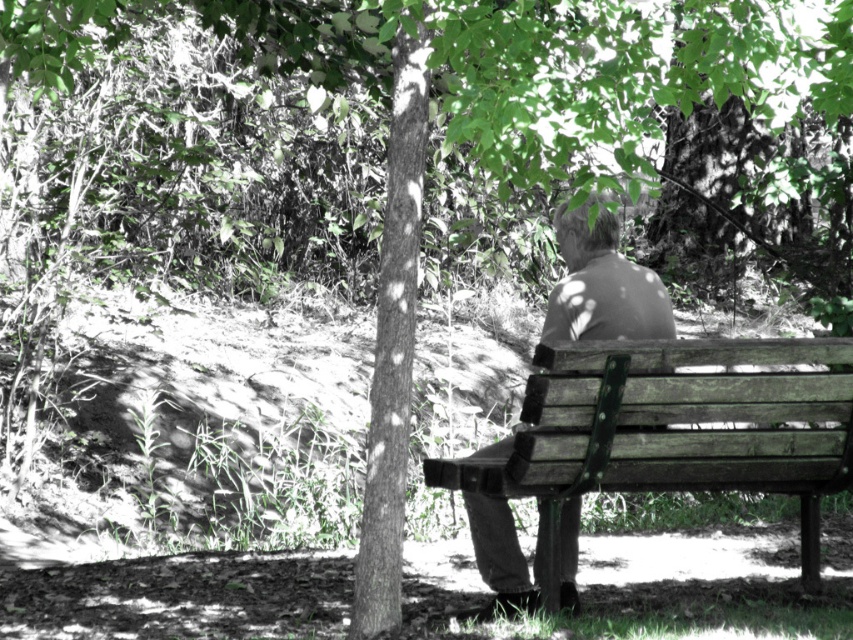
Is wooden bench at lower right below matte brown jacket at center?

Yes.

Who is more forward, (x=809, y=470) or (x=485, y=577)?

Point (x=809, y=470)

The width and height of the screenshot is (853, 640). I want to click on wooden bench at lower right, so click(x=672, y=429).